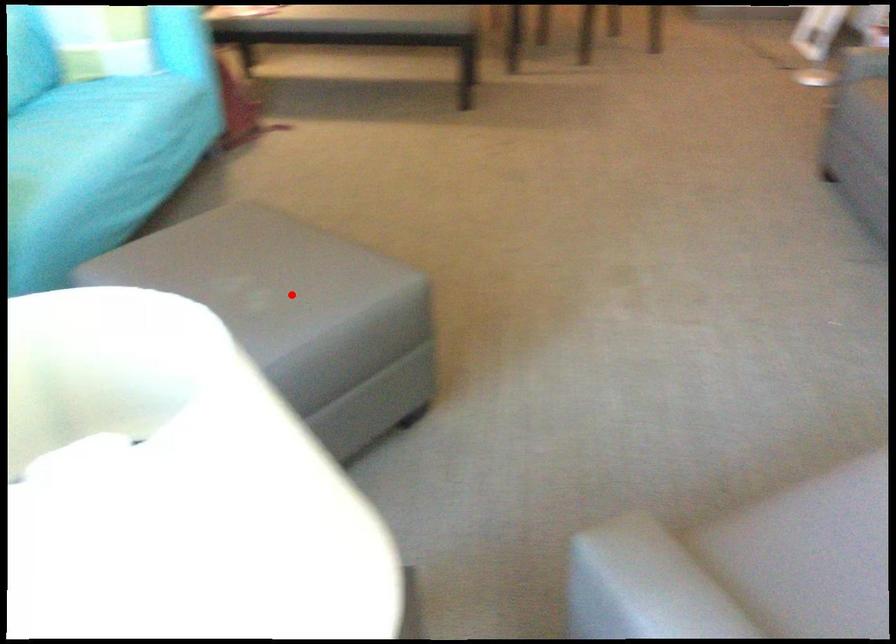
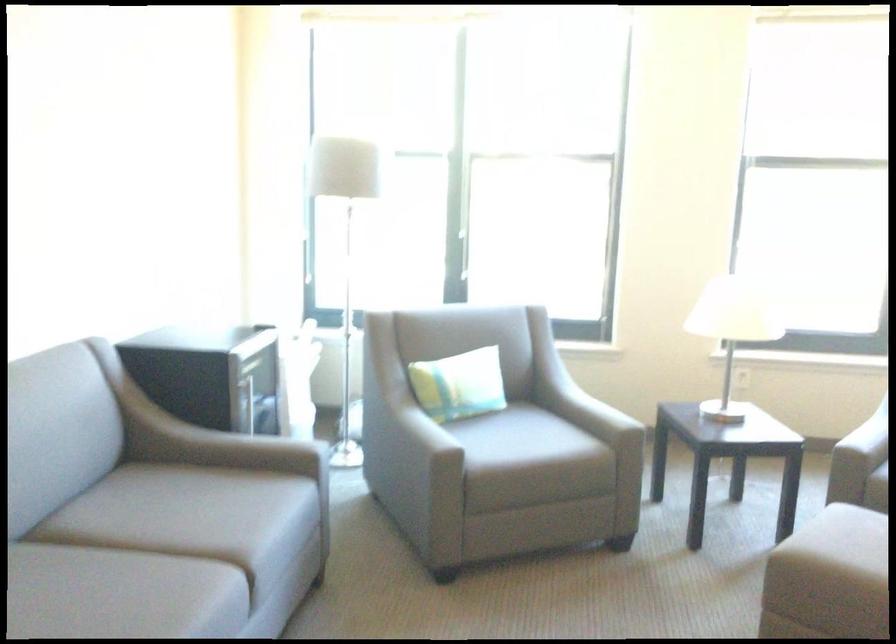
Question: I am providing you with two images of the same scene from different viewpoints. Given a red point in image1, look at the same physical point in image2. Is it:

Choices:
 (A) Closer to the viewpoint
 (B) Farther from the viewpoint

Answer: (B)